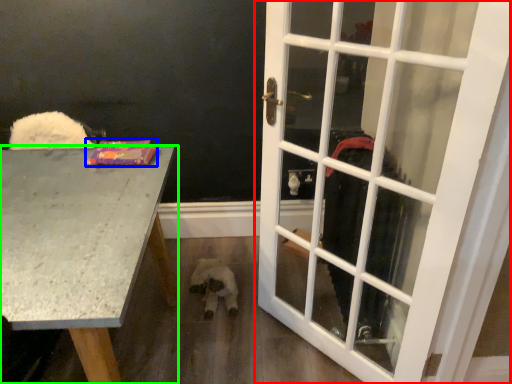
Question: Estimate the real-world distances between objects in this image. Which object is closer to door (highlighted by a red box), book (highlighted by a blue box) or desk (highlighted by a green box)?

Choices:
 (A) book
 (B) desk

Answer: (B)